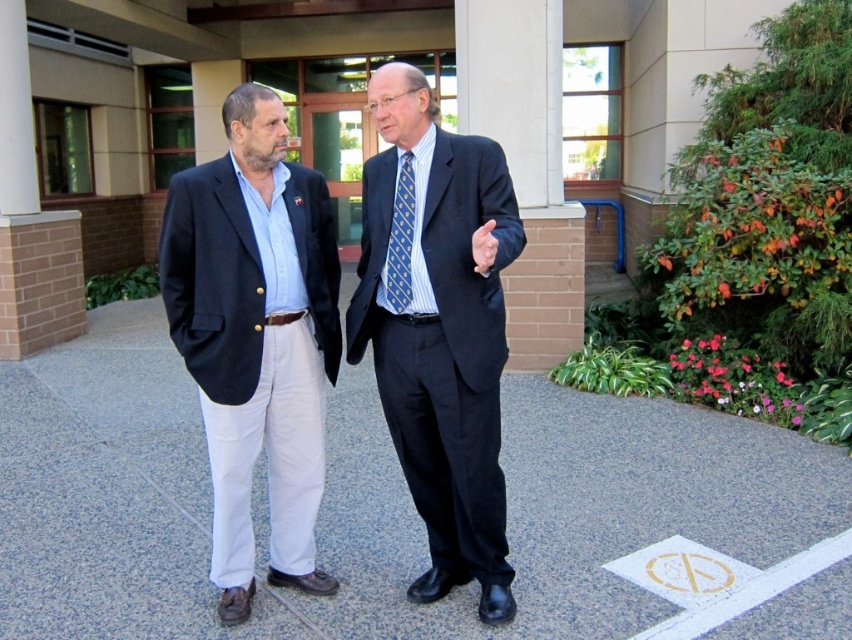
You are a photographer trying to capture both the matte black suit at center and the blue textured tie at center in a single frame. Given that your camera can only focus on objects wider than 10 cm, will both items meet the focus requirement?

The matte black suit at center is wider than the blue textured tie at center. Since the camera requires objects wider than 10 cm, and the matte black suit at center surpasses the tie in width, the suit likely meets the requirement. However, the blue textured tie at center might be narrower than 10 cm if it is smaller than the suit. Without exact measurements, we can only confirm the suit meets the requirement, but the tie may not.

You are a fashion designer observing two items in the scene. You need to determine which item is bigger. The items are the matte black blazer at left and the blue textured tie at center. Which one is larger?

The matte black blazer at left is larger than the blue textured tie at center.

You are standing in front of the building and want to place a small statue between the two points labeled as point (320, 259) and point (403, 221). Since the statue is 0.1 meters tall, will it be visible from your current position?

Point (320, 259) is further to the viewer than point (403, 221). The statue placed between them will be visible from your current position because it is positioned closer to the viewer at point (320, 259), making it within sight.